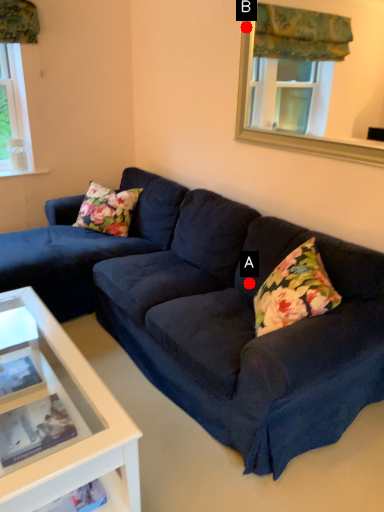
Question: Two points are circled on the image, labeled by A and B beside each circle. Which point is farther to the camera?

Choices:
 (A) A is further
 (B) B is further

Answer: (B)